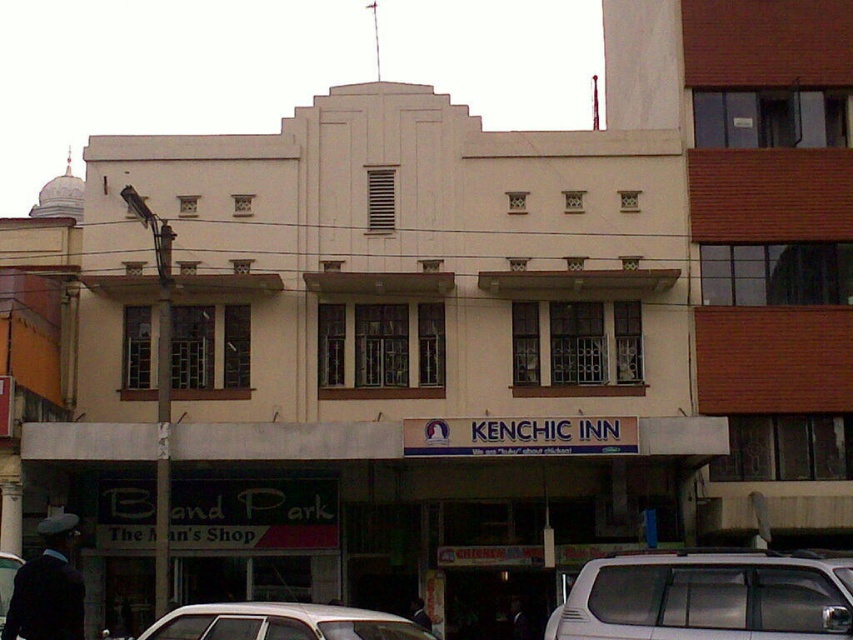
Consider the image. You are standing at the camera position and want to take a photo of the white matte car at center. The camera has a maximum focus range of 10 meters. Will you be able to capture the car in focus?

The white matte car at center and camera are 11.31 meters apart, which exceeds the camera maximum focus range of 10 meters. Therefore, you won not be able to capture the car in focus.

You are standing at the entrance of the Kenchic Inn. You need to park your car exactly at the center of the image. Is the white matte car at center already parked at the correct spot?

The white matte car at center is located at point (280, 621), which is the center of the image. Therefore, the white matte car at center is already parked at the correct spot.

You are a delivery person trying to park your vehicle in a tight space between two buildings. You have a white matte van at lower right and a white matte car at center. Which vehicle would require less vertical clearance to pass under a low hanging branch above the parking area?

The white matte van at lower right has a lesser height compared to the white matte car at center, so it would require less vertical clearance to pass under the low hanging branch.